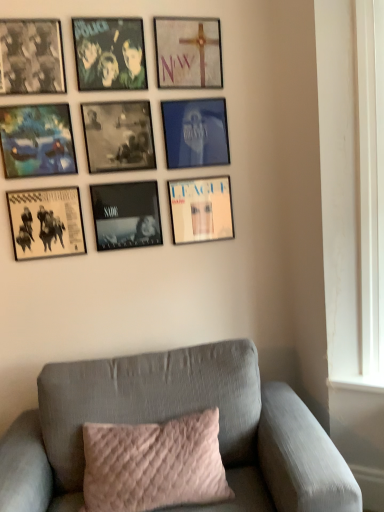
Question: Do you think matte blue painting at upper left, which is the fourth picture frame in bottom-to-top order, is within black matte picture frame at center, which is counted as the second picture frame, starting from the bottom, or outside of it?

Choices:
 (A) inside
 (B) outside

Answer: (B)

Question: In terms of size, does matte blue painting at upper left, the 6th picture frame when ordered from top to bottom, appear bigger or smaller than black matte picture frame at center, arranged as the 8th picture frame when viewed from the top?

Choices:
 (A) big
 (B) small

Answer: (A)

Question: Estimate the real-world distances between objects in this image. Which object is farther from the matte black picture frame at upper left, the seventh picture frame positioned from the bottom?

Choices:
 (A) matte white cross at upper center, acting as the 9th picture frame starting from the bottom
 (B) blue glossy picture frame at upper center, which is counted as the 4th picture frame, starting from the top
 (C) matte white album cover at lower right, arranged as the 3th picture frame when ordered from the bottom
 (D) matte black album cover at lower left, marked as the ninth picture frame in a top-to-bottom arrangement
 (E) black matte picture frame at center, the fifth picture frame from the bottom

Answer: (C)

Question: Based on their relative distances, which object is nearer to the black matte picture frame at center, the fifth picture frame from the bottom?

Choices:
 (A) pink quilted pillow at center
 (B) matte blue painting at upper left, which is the fourth picture frame in bottom-to-top order
 (C) gray fabric couch at lower center
 (D) matte white album cover at lower right, arranged as the 3th picture frame when ordered from the bottom
 (E) matte black album cover at lower left, marked as the ninth picture frame in a top-to-bottom arrangement

Answer: (B)